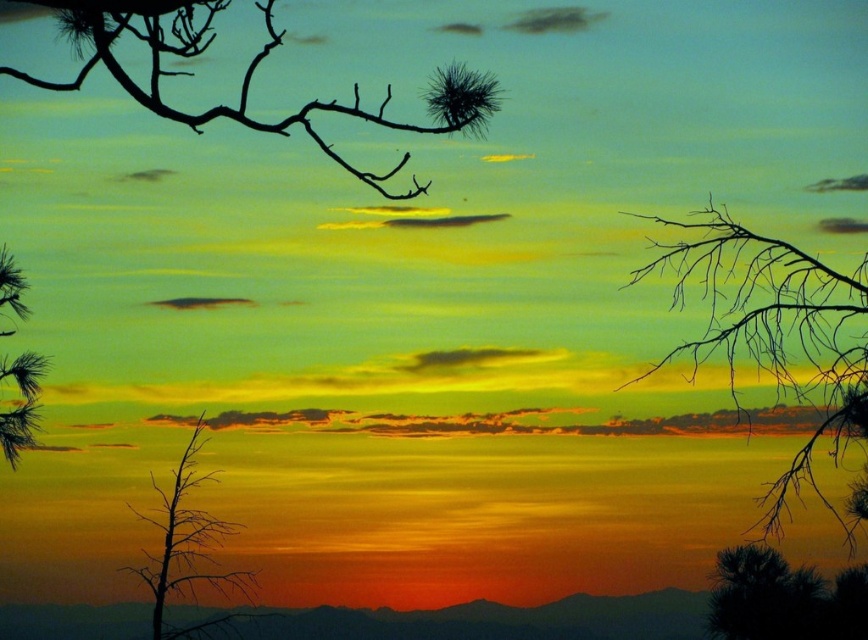
Based on the photo, you are an artist trying to paint the sunset scene. You notice the silhouette branch at upper right and the black matte branch at upper left. Which branch is closer to the top of the painting?

The black matte branch at upper left is closer to the top of the painting because the silhouette branch at upper right is positioned under it.

You are an artist painting this sunset scene. You want to ensure the silhouette branch at upper right and the black matte branch at upper left are proportionally accurate. Which branch should you draw thinner to maintain the scene balance?

The silhouette branch at upper right should be drawn thinner since it has a lesser width compared to the black matte branch at upper left according to the description.